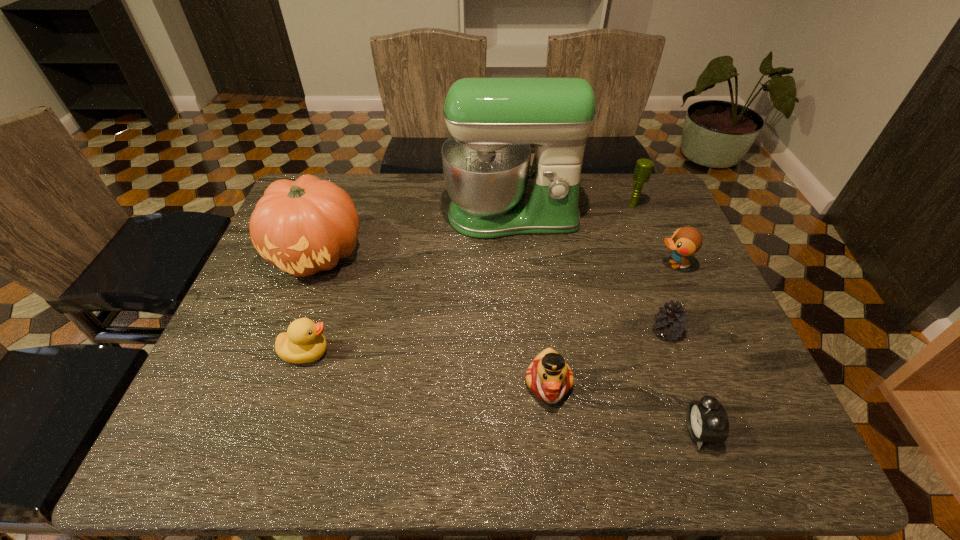
Find the location of a particular element. This screenshot has width=960, height=540. mixer present at the far edge is located at coordinates (493, 121).

Find the location of a particular element. microphone that is at the far edge is located at coordinates (643, 169).

Image resolution: width=960 pixels, height=540 pixels. I want to click on object at the near edge, so click(707, 421).

Where is `pumpkin at the left edge`? The width and height of the screenshot is (960, 540). pumpkin at the left edge is located at coordinates (305, 226).

This screenshot has width=960, height=540. Find the location of `duck situated at the left edge`. duck situated at the left edge is located at coordinates (303, 342).

This screenshot has width=960, height=540. I want to click on microphone at the right edge, so click(643, 169).

This screenshot has height=540, width=960. I want to click on duck that is at the right edge, so click(x=686, y=241).

Where is `pinecone that is at the right edge`? The width and height of the screenshot is (960, 540). pinecone that is at the right edge is located at coordinates (670, 322).

This screenshot has width=960, height=540. In order to click on alarm clock that is at the right edge in this screenshot , I will do `click(707, 421)`.

Where is `object that is positioned at the far right corner`? object that is positioned at the far right corner is located at coordinates (643, 169).